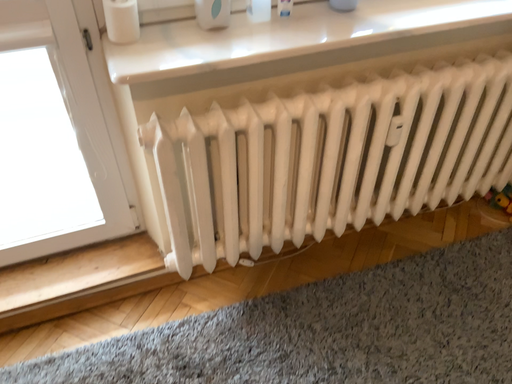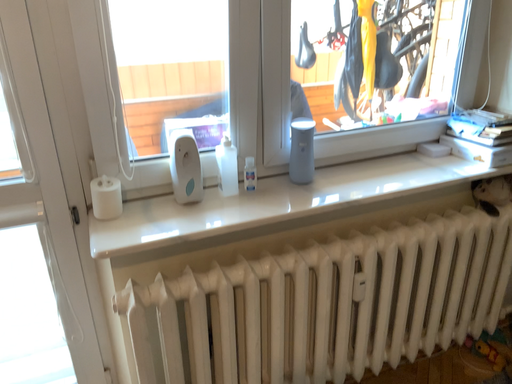
Question: How did the camera likely rotate when shooting the video?

Choices:
 (A) rotated upward
 (B) rotated downward

Answer: (A)